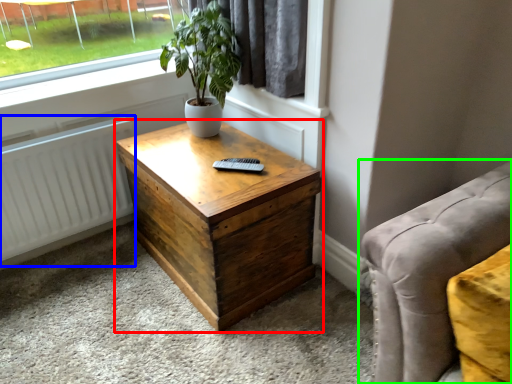
Question: Which is nearer to the nightstand (highlighted by a red box)? radiator (highlighted by a blue box) or studio couch (highlighted by a green box).

Choices:
 (A) radiator
 (B) studio couch

Answer: (A)